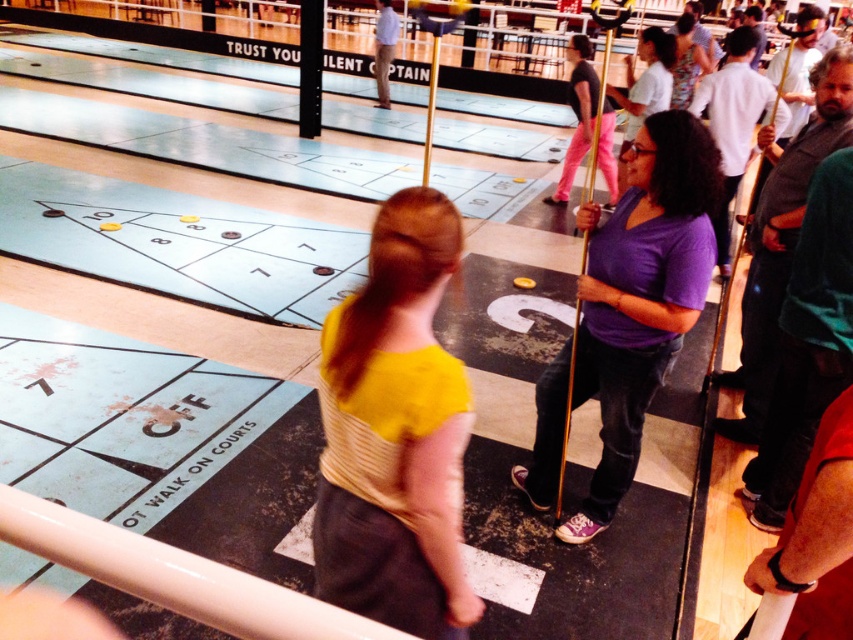
You are observing the shuffleboard game and notice two people wearing purple. One is the purple matte shirt at center and the other is the matte purple shirt at center. Which one is closer to you?

The purple matte shirt at center is closer to the viewer than the matte purple shirt at center.

You are a shuffleboard player who wants to pass between the yellow fabric shirt at center and the purple matte shirt at center to retrieve your puck. The space between them is narrow. Can you walk through the gap if you need a minimum of 0.8 meters to pass comfortably?

The yellow fabric shirt at center is 1.20 meters away from the purple matte shirt at center. Since the minimum required space is 0.8 meters, you can comfortably walk through the gap between them.

You are a photographer positioned at the back of the shuffleboard court. You need to take a photo that includes both the yellow fabric shirt at center and the purple matte shirt at center. Which shirt will appear smaller in the photo?

The yellow fabric shirt at center will appear smaller in the photo because it is not as tall as the purple matte shirt at center.